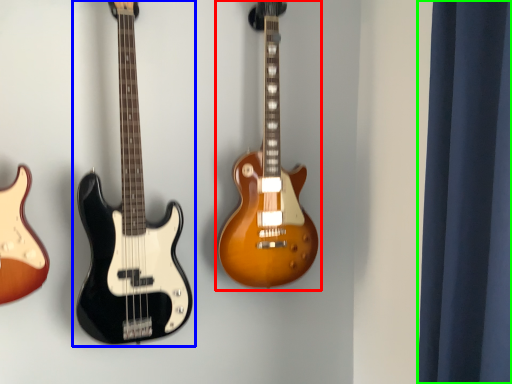
Question: Based on their relative distances, which object is farther from guitar (highlighted by a red box)? Choose from guitar (highlighted by a blue box) and curtain (highlighted by a green box).

Choices:
 (A) guitar
 (B) curtain

Answer: (B)